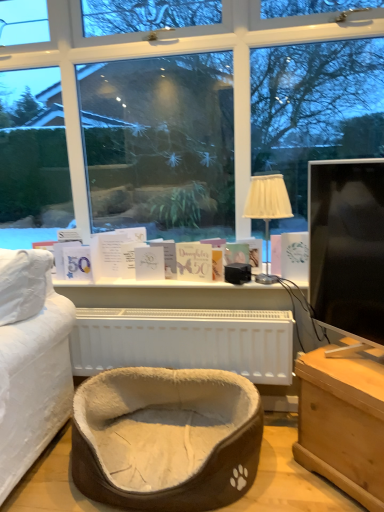
Question: Should I look upward or downward to see light brown wooden chest at lower right?

Choices:
 (A) down
 (B) up

Answer: (A)

Question: Does beige fabric lampshade at center have a greater height compared to white paper card at center, positioned as the third book in right-to-left order?

Choices:
 (A) yes
 (B) no

Answer: (A)

Question: Considering the relative sizes of beige fabric lampshade at center and white paper card at center, positioned as the third book in right-to-left order, in the image provided, is beige fabric lampshade at center shorter than white paper card at center, positioned as the third book in right-to-left order,?

Choices:
 (A) no
 (B) yes

Answer: (A)

Question: From the image's perspective, is beige fabric lampshade at center located above white paper card at center, the first book viewed from the left?

Choices:
 (A) yes
 (B) no

Answer: (A)

Question: Does beige fabric lampshade at center have a lesser width compared to white paper card at center, positioned as the third book in right-to-left order?

Choices:
 (A) no
 (B) yes

Answer: (A)

Question: Would you say beige fabric lampshade at center is outside white paper card at center, the first book viewed from the left?

Choices:
 (A) yes
 (B) no

Answer: (A)

Question: Does beige fabric lampshade at center have a larger size compared to white paper card at center, positioned as the third book in right-to-left order?

Choices:
 (A) no
 (B) yes

Answer: (B)

Question: Is beige plush pet bed at center facing away from beige fabric lampshade at center?

Choices:
 (A) yes
 (B) no

Answer: (B)

Question: Are beige plush pet bed at center and beige fabric lampshade at center far apart?

Choices:
 (A) yes
 (B) no

Answer: (B)

Question: From the image's perspective, is beige plush pet bed at center beneath beige fabric lampshade at center?

Choices:
 (A) no
 (B) yes

Answer: (B)

Question: Does beige plush pet bed at center have a lesser width compared to beige fabric lampshade at center?

Choices:
 (A) yes
 (B) no

Answer: (B)

Question: Can we say beige plush pet bed at center lies outside beige fabric lampshade at center?

Choices:
 (A) yes
 (B) no

Answer: (A)

Question: Is the position of beige plush pet bed at center more distant than that of beige fabric lampshade at center?

Choices:
 (A) no
 (B) yes

Answer: (A)

Question: Is beige plush pet bed at center at the right side of black glossy monitor at right?

Choices:
 (A) yes
 (B) no

Answer: (B)